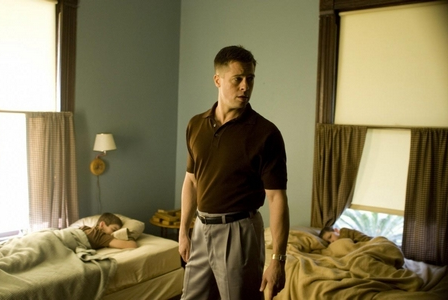
Image resolution: width=448 pixels, height=300 pixels. Identify the location of pillow. (132, 228), (314, 230).